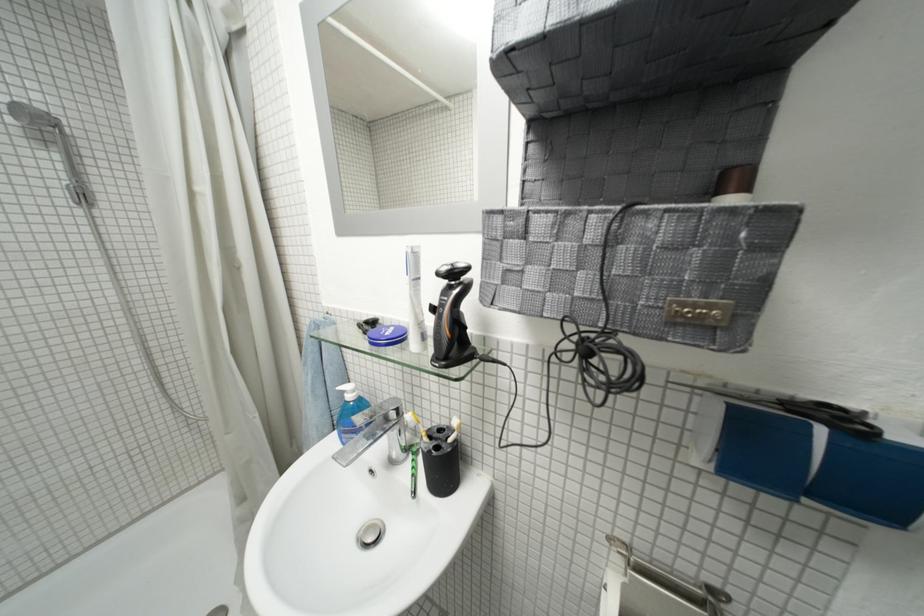
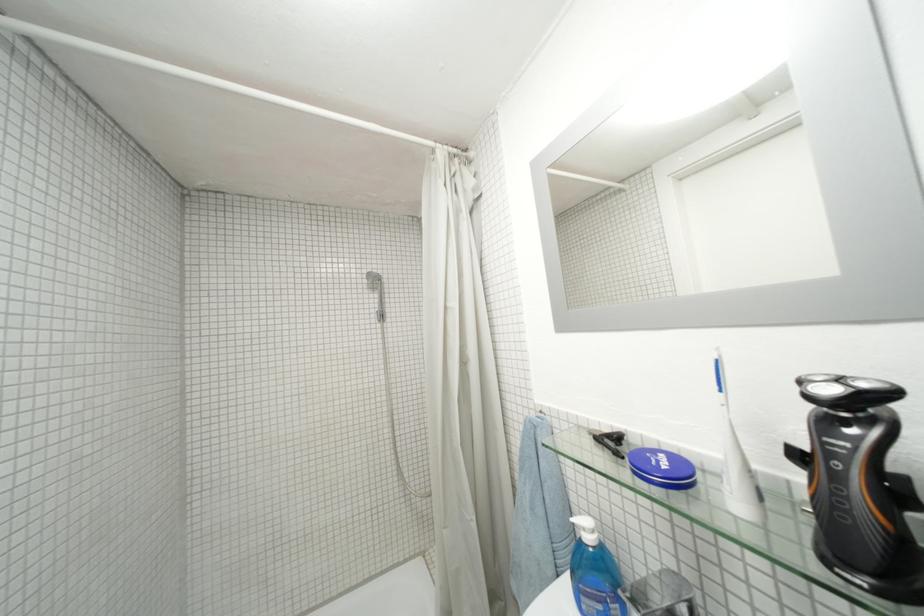
Find the pixel in the second image that matches point 377,325 in the first image.

(617, 439)